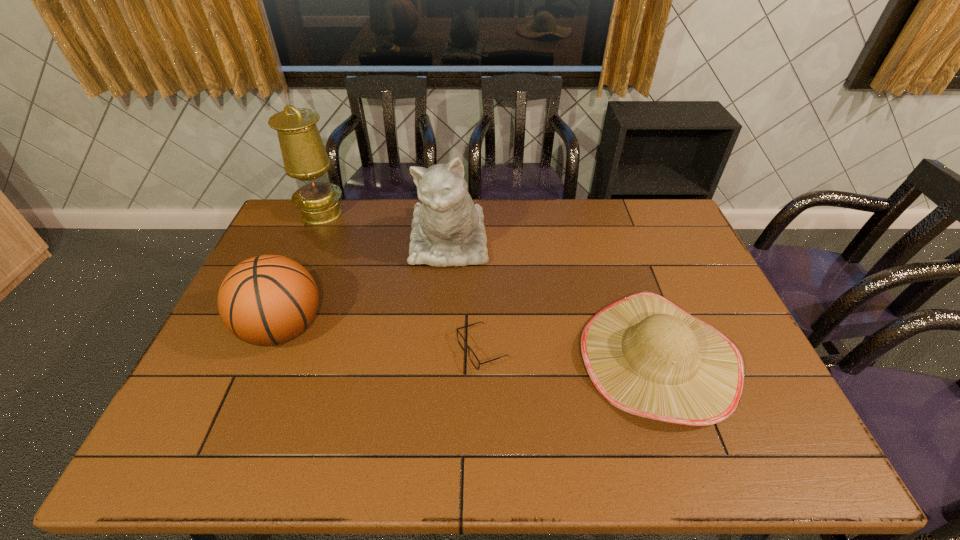
What are the coordinates of `vacant point located between the basketball and the shortest object` in the screenshot? It's located at (383, 339).

Locate an element on the screen. This screenshot has height=540, width=960. vacant space in between the oil lamp and the cat is located at coordinates (385, 227).

Locate an element on the screen. Image resolution: width=960 pixels, height=540 pixels. free space between the shortest object and the cat is located at coordinates (466, 295).

What are the coordinates of `vacant space in between the cat and the third shortest object` in the screenshot? It's located at (366, 285).

I want to click on object that is the fourth closest to the cat, so click(x=305, y=158).

At what (x,y) coordinates should I click in order to perform the action: click on object that is the fourth nearest to the third tallest object. Please return your answer as a coordinate pair (x, y). The height and width of the screenshot is (540, 960). Looking at the image, I should click on (645, 355).

You are a GUI agent. You are given a task and a screenshot of the screen. Output one action in this format:
    pyautogui.click(x=<x>, y=<y>)
    Task: Click on the vacant space that satisfies the following two spatial constraints: 1. with the lenses facing outward on the spectacles; 2. on the right side of the second shortest object
    The width and height of the screenshot is (960, 540).
    Given the screenshot: What is the action you would take?
    pyautogui.click(x=482, y=359)

Find the location of a particular element. Image resolution: width=960 pixels, height=540 pixels. free spot that satisfies the following two spatial constraints: 1. on the front-facing side of the cat; 2. on the left side of the rightmost object is located at coordinates (440, 359).

You are a GUI agent. You are given a task and a screenshot of the screen. Output one action in this format:
    pyautogui.click(x=<x>, y=<y>)
    Task: Click on the vacant area in the image that satisfies the following two spatial constraints: 1. on the back side of the second shortest object; 2. with the lenses facing outward on the shortest object
    The height and width of the screenshot is (540, 960).
    Given the screenshot: What is the action you would take?
    pyautogui.click(x=655, y=350)

Image resolution: width=960 pixels, height=540 pixels. Identify the location of vacant area that satisfies the following two spatial constraints: 1. with the lenses facing outward on the rightmost object; 2. on the right side of the spectacles. (482, 359).